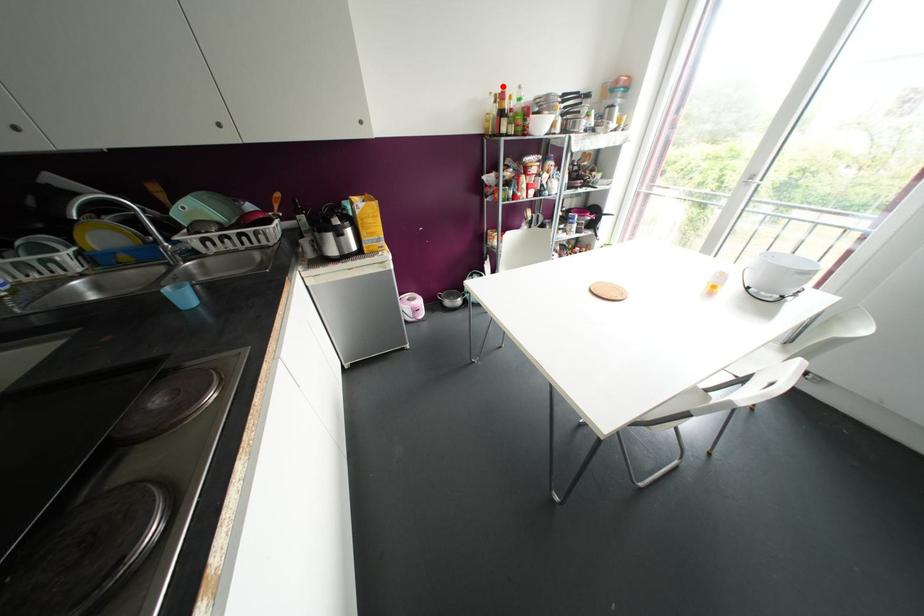
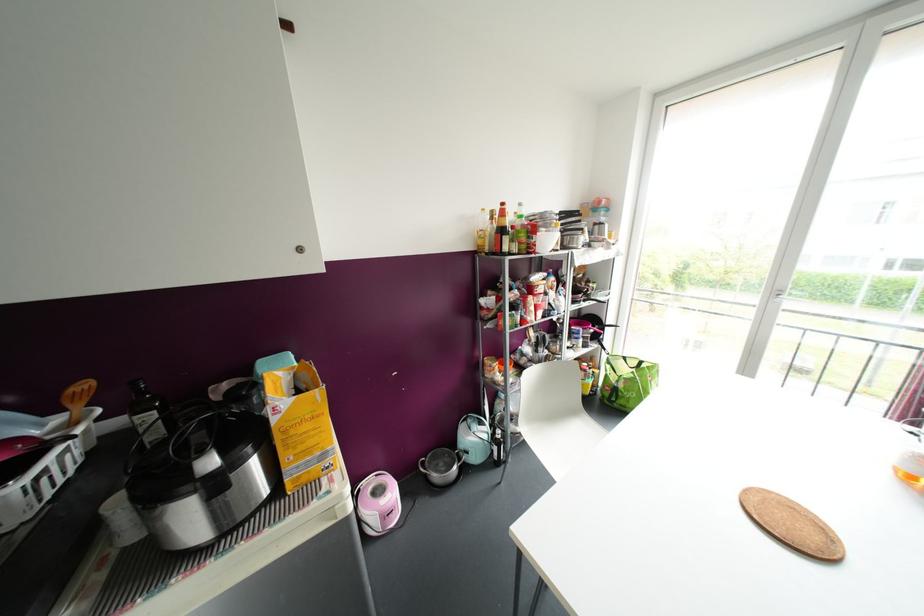
Find the pixel in the second image that matches the highlighted location in the first image.

(502, 204)